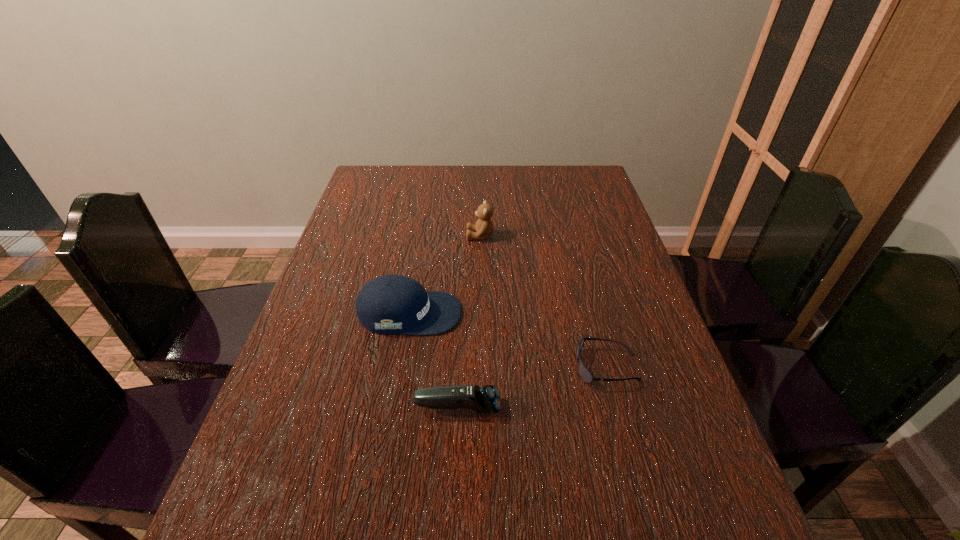
Where is `free space that is in between the electric shaver and the farthest object`? free space that is in between the electric shaver and the farthest object is located at coordinates (469, 322).

Identify which object is located as the third nearest to the nearest object. Please provide its 2D coordinates. Your answer should be formatted as a tuple, i.e. [(x, y)], where the tuple contains the x and y coordinates of a point satisfying the conditions above.

[(484, 226)]

Select which object is the third closest to the baseball cap. Please provide its 2D coordinates. Your answer should be formatted as a tuple, i.e. [(x, y)], where the tuple contains the x and y coordinates of a point satisfying the conditions above.

[(585, 374)]